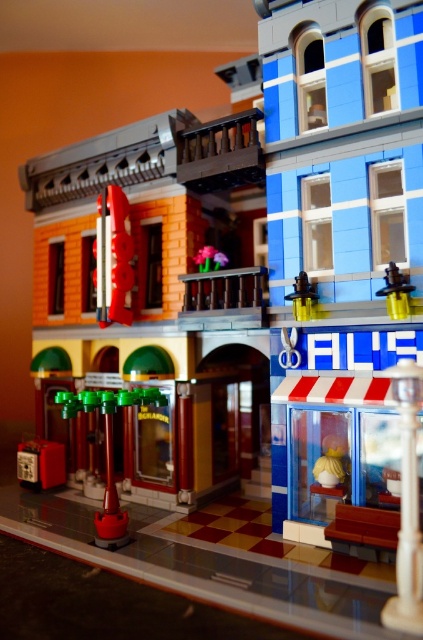
Question: Among these objects, which one is farthest from the camera?

Choices:
 (A) green plastic street lamp at lower left
 (B) yellow plastic toy at upper right
 (C) metallic silver pen at upper left
 (D) matte yellow vase at center

Answer: (C)

Question: Which point is farther to the camera?

Choices:
 (A) metallic silver pen at upper left
 (B) matte yellow vase at center
 (C) green plastic street lamp at lower left

Answer: (A)

Question: Is the position of metallic silver pen at upper left more distant than that of matte yellow vase at center?

Choices:
 (A) yes
 (B) no

Answer: (A)

Question: Does metallic silver pen at upper left appear over matte yellow vase at center?

Choices:
 (A) no
 (B) yes

Answer: (B)

Question: Does matte yellow vase at center have a greater width compared to yellow plastic toy at upper right?

Choices:
 (A) yes
 (B) no

Answer: (A)

Question: Which object appears farthest from the camera in this image?

Choices:
 (A) matte yellow vase at center
 (B) yellow plastic toy at upper right
 (C) green plastic street lamp at lower left
 (D) metallic silver pen at upper left

Answer: (D)